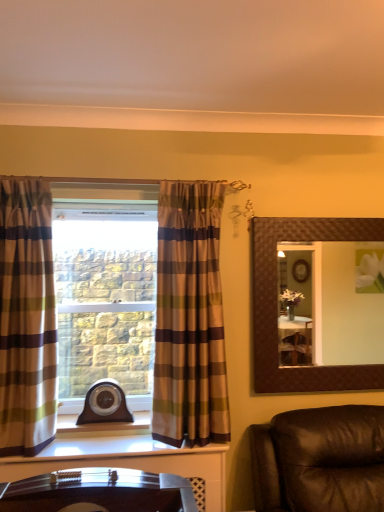
Image resolution: width=384 pixels, height=512 pixels. I want to click on free point above brown textured mirror at upper right (from a real-world perspective), so click(x=319, y=218).